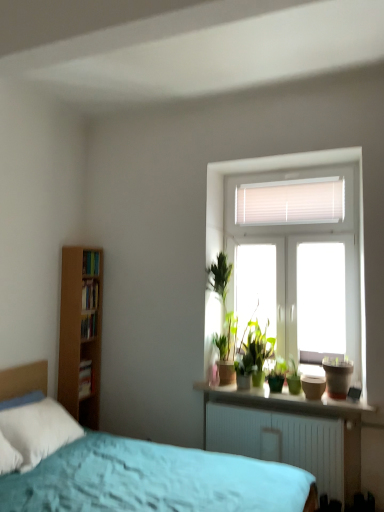
You are a GUI agent. You are given a task and a screenshot of the screen. Output one action in this format:
    pyautogui.click(x=<x>, y=<y>)
    Task: Click on the smooth concrete window sill at center
    
    Given the screenshot: What is the action you would take?
    pyautogui.click(x=282, y=401)

Measure the distance between green matte houseplant at center and camera.

green matte houseplant at center is 3.14 meters away from camera.

What is the approximate height of wooden bookshelf at left, which appears as the 2th book when viewed from the top?

wooden bookshelf at left, which appears as the 2th book when viewed from the top, is 21.65 centimeters tall.

In order to face matte brown flowerpot at right, should I rotate leftwards or rightwards?

Turn right by 18.956 degrees to look at matte brown flowerpot at right.

At what (x,y) coordinates should I click in order to perform the action: click on hardcover books at left, which is the fourth book from bottom to top. Please return your answer as a coordinate pair (x, y). Image resolution: width=384 pixels, height=512 pixels. Looking at the image, I should click on (91, 262).

Is matte brown flowerpot at right positioned with its back to green matte houseplant at center?

matte brown flowerpot at right does not have its back to green matte houseplant at center.

Can you tell me how much matte brown flowerpot at right and green matte houseplant at center differ in facing direction?

0.000456 degrees.

Considering the relative positions of matte brown flowerpot at right and green matte houseplant at center in the image provided, is matte brown flowerpot at right to the left of green matte houseplant at center from the viewer's perspective?

Incorrect, matte brown flowerpot at right is not on the left side of green matte houseplant at center.

Is point (83, 268) closer or farther from the camera than point (84, 302)?

Point (83, 268) is positioned closer to the camera compared to point (84, 302).

Considering the relative positions of hardcover books at left, which is counted as the 1th book, starting from the top, and wooden bookshelf at left, which appears as the 2th book when viewed from the top, in the image provided, is hardcover books at left, which is counted as the 1th book, starting from the top, to the left of wooden bookshelf at left, which appears as the 2th book when viewed from the top, from the viewer's perspective?

In fact, hardcover books at left, which is counted as the 1th book, starting from the top, is to the right of wooden bookshelf at left, which appears as the 2th book when viewed from the top.

From the image's perspective, is hardcover books at left, which is the fourth book from bottom to top, located above wooden bookshelf at left, which appears as the 2th book when viewed from the top?

Yes, from the image's perspective, hardcover books at left, which is the fourth book from bottom to top, is over wooden bookshelf at left, which appears as the 2th book when viewed from the top.

From a real-world perspective, is hardcover books at left, which is the fourth book from bottom to top, over wooden bookshelf at left, which appears as the 2th book when viewed from the top?

Result: Yes, from a real-world perspective, hardcover books at left, which is the fourth book from bottom to top, is over wooden bookshelf at left, which appears as the 2th book when viewed from the top

From a real-world perspective, which is physically below, wooden bookshelf at left, the third book when ordered from bottom to top, or matte brown flowerpot at right?

matte brown flowerpot at right.

In terms of height, does wooden bookshelf at left, which appears as the 2th book when viewed from the top, look taller or shorter compared to matte brown flowerpot at right?

Result: In the image, wooden bookshelf at left, which appears as the 2th book when viewed from the top, appears to be shorter than matte brown flowerpot at right.

How many degrees apart are the facing directions of wooden bookshelf at left, the third book when ordered from bottom to top, and matte brown flowerpot at right?

The angle between the facing direction of wooden bookshelf at left, the third book when ordered from bottom to top, and the facing direction of matte brown flowerpot at right is 92.7 degrees.

How far apart are wooden bookshelf at left, the third book when ordered from bottom to top, and matte brown flowerpot at right?

They are 2.10 meters apart.

Is wooden bookshelf at left, the third book when ordered from bottom to top, not close to hardcover book at left, which appears as the second book when ordered from the bottom?

wooden bookshelf at left, the third book when ordered from bottom to top, is actually quite close to hardcover book at left, which appears as the second book when ordered from the bottom.

Which is behind, wooden bookshelf at left, the third book when ordered from bottom to top, or hardcover book at left, which appears as the second book when ordered from the bottom?

wooden bookshelf at left, the third book when ordered from bottom to top, is further away from the camera.

From the picture: How different are the orientations of wooden bookshelf at left, which appears as the 2th book when viewed from the top, and hardcover book at left, which appears as the second book when ordered from the bottom, in degrees?

There is a 0.00213-degree angle between the facing directions of wooden bookshelf at left, which appears as the 2th book when viewed from the top, and hardcover book at left, which appears as the second book when ordered from the bottom.

Is point (94, 293) positioned behind point (94, 326)?

That is False.

In the scene shown: Is matte brown flowerpot at right oriented towards hardcover books at left, which is counted as the 1th book, starting from the top?

No, matte brown flowerpot at right does not turn towards hardcover books at left, which is counted as the 1th book, starting from the top.

Which of these two, matte brown flowerpot at right or hardcover books at left, which is the fourth book from bottom to top, is thinner?

hardcover books at left, which is the fourth book from bottom to top, is thinner.

This screenshot has width=384, height=512. Identify the location of flowerpot on the right side of hardcover books at left, which is counted as the 1th book, starting from the top. (337, 376).

Between matte brown flowerpot at right and hardcover books at left, which is the fourth book from bottom to top, which one has smaller size?

hardcover books at left, which is the fourth book from bottom to top, is smaller.

Is wooden bookshelf at left, the third book when ordered from bottom to top, at the right side of green matte houseplant at center?

No, wooden bookshelf at left, the third book when ordered from bottom to top, is not to the right of green matte houseplant at center.

Considering the sizes of objects wooden bookshelf at left, which appears as the 2th book when viewed from the top, and green matte houseplant at center in the image provided, who is taller, wooden bookshelf at left, which appears as the 2th book when viewed from the top, or green matte houseplant at center?

green matte houseplant at center is taller.

From the image's perspective, is wooden bookshelf at left, which appears as the 2th book when viewed from the top, on top of green matte houseplant at center?

Correct, wooden bookshelf at left, which appears as the 2th book when viewed from the top, appears higher than green matte houseplant at center in the image.

Can you tell me how much wooden bookshelf at left, the third book when ordered from bottom to top, and green matte houseplant at center differ in facing direction?

wooden bookshelf at left, the third book when ordered from bottom to top, and green matte houseplant at center are facing 92.7 degrees away from each other.

How many degrees apart are the facing directions of green matte houseplant at center and matte brown flowerpot at right?

0.000456 degrees.

Considering the positions of objects green matte houseplant at center and matte brown flowerpot at right in the image provided, who is more to the right, green matte houseplant at center or matte brown flowerpot at right?

matte brown flowerpot at right.

Do you think green matte houseplant at center is within matte brown flowerpot at right, or outside of it?

green matte houseplant at center is not enclosed by matte brown flowerpot at right.

Consider the image. Looking at their sizes, would you say green matte houseplant at center is wider or thinner than matte brown flowerpot at right?

green matte houseplant at center is thinner than matte brown flowerpot at right.

The height and width of the screenshot is (512, 384). What are the coordinates of `houseplant located on the left of matte brown flowerpot at right` in the screenshot? It's located at (293, 376).

The height and width of the screenshot is (512, 384). I want to click on book above the wooden bookshelf at left, which appears as the 2th book when viewed from the top (from a real-world perspective), so click(x=91, y=262).

Estimate the real-world distances between objects in this image. Which object is further from hardcover book at left, which appears as the second book when ordered from the bottom, wooden bookshelf at left, the third book when ordered from bottom to top, or white paper book at left, the 1th book in the bottom-to-top sequence?

The object further to hardcover book at left, which appears as the second book when ordered from the bottom, is white paper book at left, the 1th book in the bottom-to-top sequence.

Considering their positions, is matte brown flowerpot at right positioned closer to smooth concrete window sill at center than green matte houseplant at center?

Based on the image, green matte houseplant at center appears to be nearer to smooth concrete window sill at center.

Looking at the image, which one is located further to white paper book at left, the 4th book positioned from the top, smooth concrete window sill at center or matte brown flowerpot at right?

Among the two, matte brown flowerpot at right is located further to white paper book at left, the 4th book positioned from the top.

From the image, which object appears to be farther from green matte houseplant at center, matte brown flowerpot at right or wooden bookshelf at left, the third book when ordered from bottom to top?

wooden bookshelf at left, the third book when ordered from bottom to top, is further to green matte houseplant at center.

Considering their positions, is hardcover book at left, the 3th book positioned from the top, positioned further to wooden bookshelf at left, which appears as the 2th book when viewed from the top, than matte brown flowerpot at right?

A: matte brown flowerpot at right is further to wooden bookshelf at left, which appears as the 2th book when viewed from the top.

Which object lies nearer to the anchor point white paper book at left, the 4th book positioned from the top, hardcover books at left, which is counted as the 1th book, starting from the top, or matte brown flowerpot at right?

Among the two, hardcover books at left, which is counted as the 1th book, starting from the top, is located nearer to white paper book at left, the 4th book positioned from the top.

Estimate the real-world distances between objects in this image. Which object is closer to white paper book at left, the 1th book in the bottom-to-top sequence, wooden bookshelf at left, which appears as the 2th book when viewed from the top, or hardcover books at left, which is the fourth book from bottom to top?

wooden bookshelf at left, which appears as the 2th book when viewed from the top, lies closer to white paper book at left, the 1th book in the bottom-to-top sequence, than the other object.

Which object lies further to the anchor point white paper book at left, the 1th book in the bottom-to-top sequence, smooth concrete window sill at center or green matte houseplant at center?

Among the two, green matte houseplant at center is located further to white paper book at left, the 1th book in the bottom-to-top sequence.

The image size is (384, 512). Identify the location of houseplant between white paper book at left, the 1th book in the bottom-to-top sequence, and matte brown flowerpot at right from left to right. (293, 376).

I want to click on book between wooden bookshelf at left, the third book when ordered from bottom to top, and smooth concrete window sill at center, so click(91, 262).

In order to click on window sill between wooden bookshelf at left, which appears as the 2th book when viewed from the top, and matte brown flowerpot at right from left to right in this screenshot , I will do `click(282, 401)`.

Image resolution: width=384 pixels, height=512 pixels. In order to click on window sill between hardcover book at left, which appears as the second book when ordered from the bottom, and matte brown flowerpot at right, in the horizontal direction in this screenshot , I will do `click(282, 401)`.